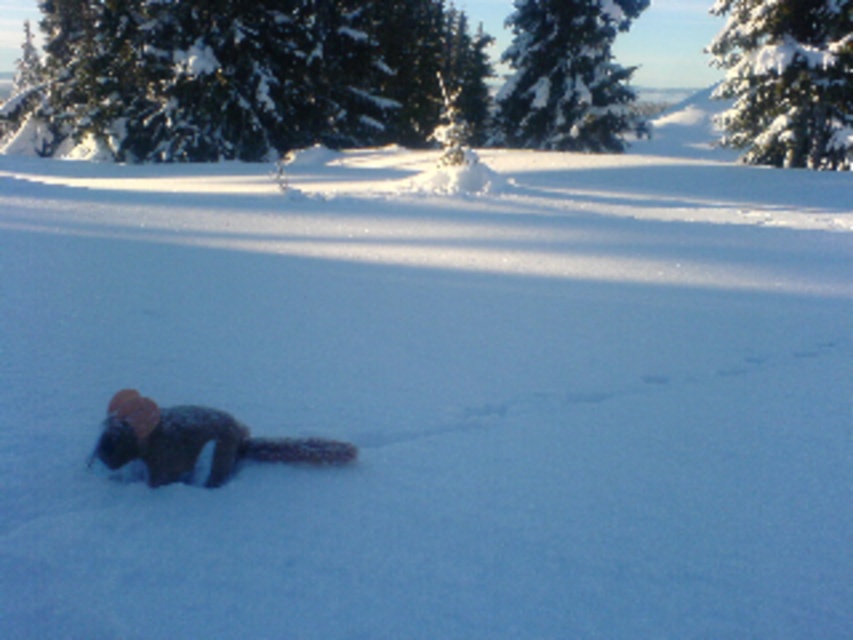
You are standing at the origin point in the snowy landscape. There are two points marked in the image. Which of the two points, point (730,12) or point (534,92), is closer to you?

Point (730,12) is in front of point (534,92), so it is closer to you.